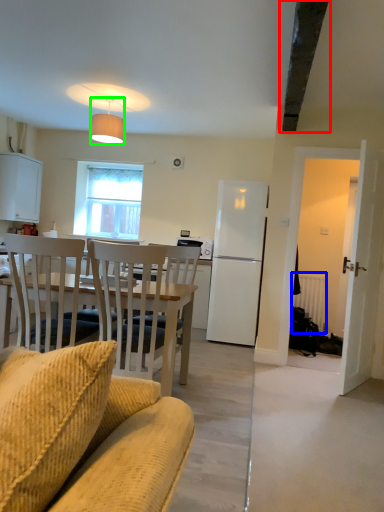
Question: Considering the real-world distances, which object is farthest from exhaust hood (highlighted by a red box)? radiator (highlighted by a blue box) or lamp (highlighted by a green box)?

Choices:
 (A) radiator
 (B) lamp

Answer: (A)